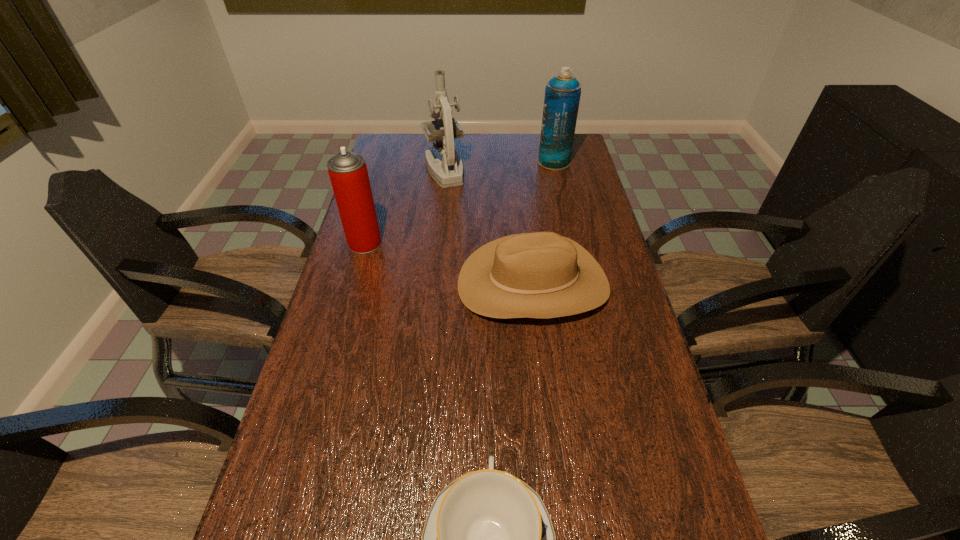
Find the location of `vacant region between the microscope and the fourth tallest object`. vacant region between the microscope and the fourth tallest object is located at coordinates (489, 227).

Locate an element on the screen. This screenshot has height=540, width=960. vacant area between the microscope and the nearer aerosol can is located at coordinates (x=404, y=207).

Locate an element on the screen. The image size is (960, 540). object that can be found as the fourth closest to the left aerosol can is located at coordinates (488, 539).

Where is `object that stands as the fourth closest to the right aerosol can`? Image resolution: width=960 pixels, height=540 pixels. object that stands as the fourth closest to the right aerosol can is located at coordinates (488, 539).

Identify the location of free location that satisfies the following two spatial constraints: 1. on the front side of the left aerosol can; 2. on the left side of the second shortest object. (353, 284).